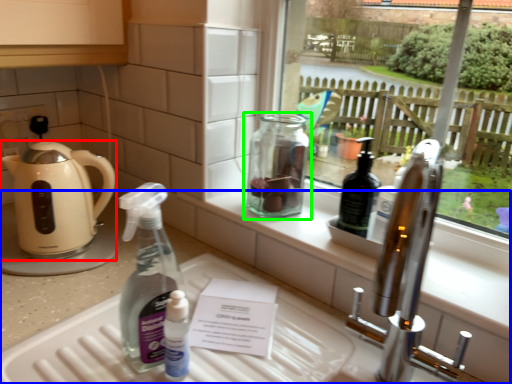
Question: Which is farther away from kettle (highlighted by a red box)? counter (highlighted by a blue box) or bottle (highlighted by a green box)?

Choices:
 (A) counter
 (B) bottle

Answer: (B)